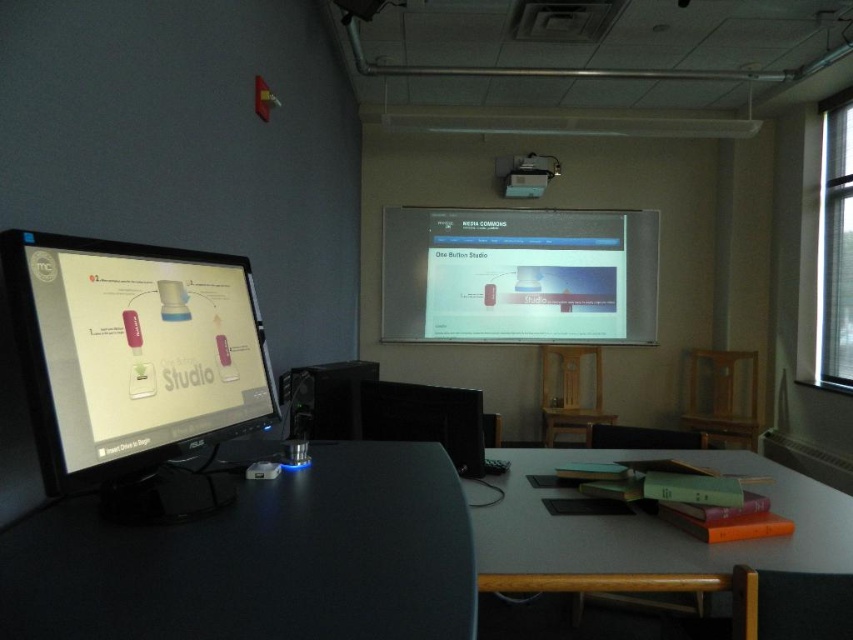
Question: Does white glossy projection screen at upper center come in front of black glossy computer monitor at center?

Choices:
 (A) no
 (B) yes

Answer: (A)

Question: Which is nearer to the black glossy computer monitor at center?

Choices:
 (A) white glossy projection screen at upper center
 (B) smooth gray table at lower right
 (C) white plastic projector at upper center
 (D) matte black monitor at left

Answer: (B)

Question: Which object is positioned farthest from the smooth gray table at lower right?

Choices:
 (A) black glossy computer monitor at center
 (B) white glossy projection screen at upper center
 (C) white plastic projector at upper center

Answer: (C)

Question: Considering the relative positions of matte black monitor at left and white glossy projection screen at upper center in the image provided, where is matte black monitor at left located with respect to white glossy projection screen at upper center?

Choices:
 (A) above
 (B) below

Answer: (B)

Question: Estimate the real-world distances between objects in this image. Which object is closer to the black glossy computer monitor at center?

Choices:
 (A) matte black monitor at left
 (B) black matte computer desk at lower left

Answer: (B)

Question: Does smooth gray table at lower right appear under black glossy computer monitor at center?

Choices:
 (A) no
 (B) yes

Answer: (B)